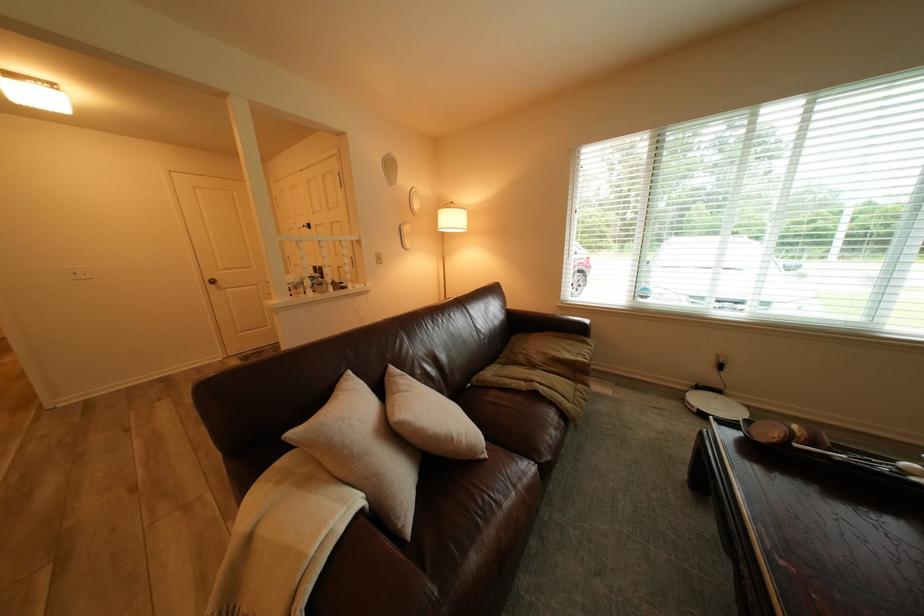
Find where to rest the brown sofa armrest. Please return your answer as a coordinate pair (x, y).

(545, 323)